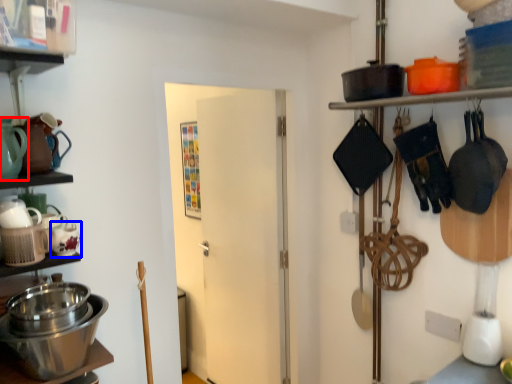
Question: Which object appears closest to the camera in this image, tea pot (highlighted by a red box) or tea pot (highlighted by a blue box)?

Choices:
 (A) tea pot
 (B) tea pot

Answer: (A)